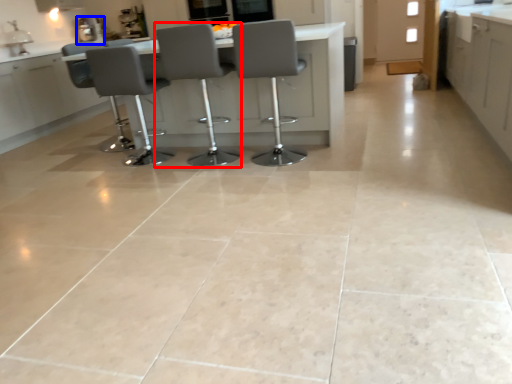
Question: Which object appears farthest to the camera in this image, chair (highlighted by a red box) or appliance (highlighted by a blue box)?

Choices:
 (A) chair
 (B) appliance

Answer: (B)